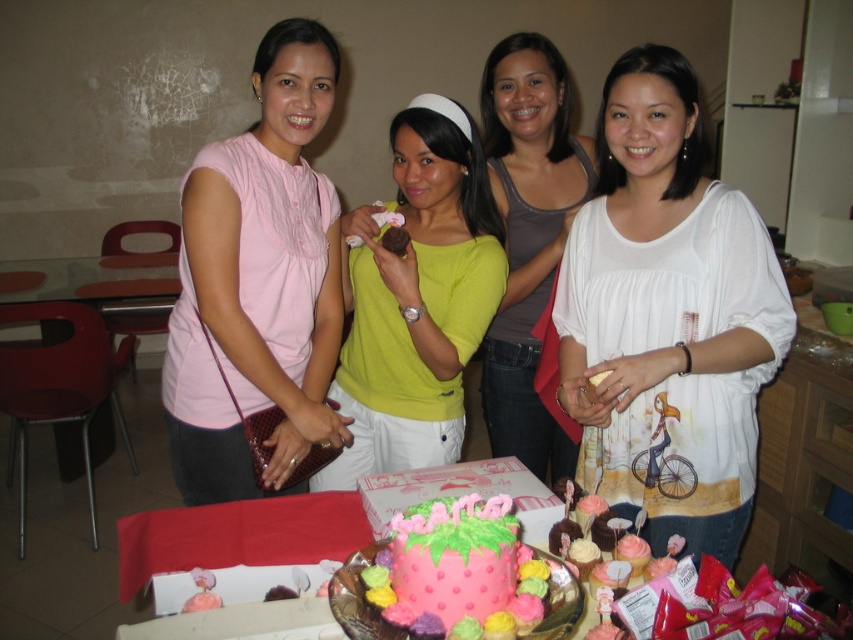
Looking at this image, based on the scene description, which woman is wearing the thinner top between the white cotton blouse at center and the matte yellow shirt at center?

The white cotton blouse at center is thinner than the matte yellow shirt at center.

You are at a party and see the matte white blouse at center and the pink frosted cake at center on the table. Which item is positioned to the right when viewed from the front?

The matte white blouse at center is positioned to the right of the pink frosted cake at center.